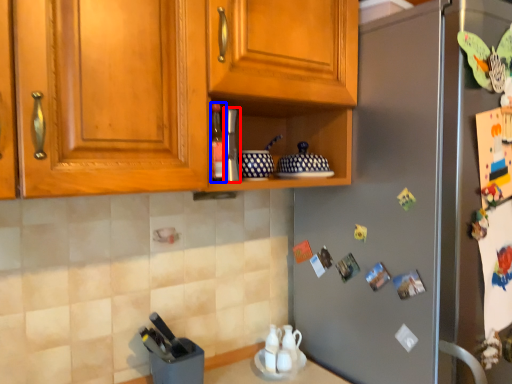
Question: Among these objects, which one is farthest to the camera, appliance (highlighted by a red box) or bottle (highlighted by a blue box)?

Choices:
 (A) appliance
 (B) bottle

Answer: (A)